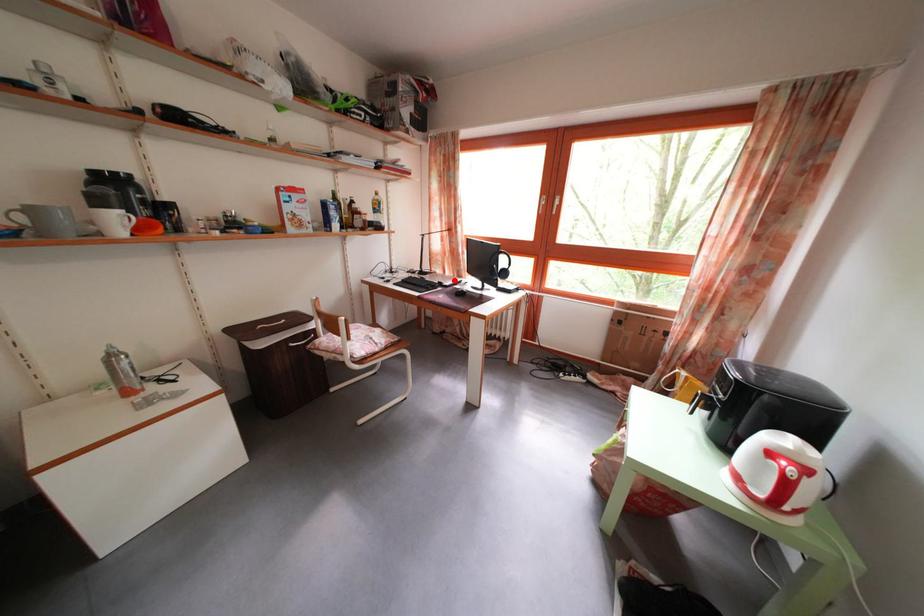
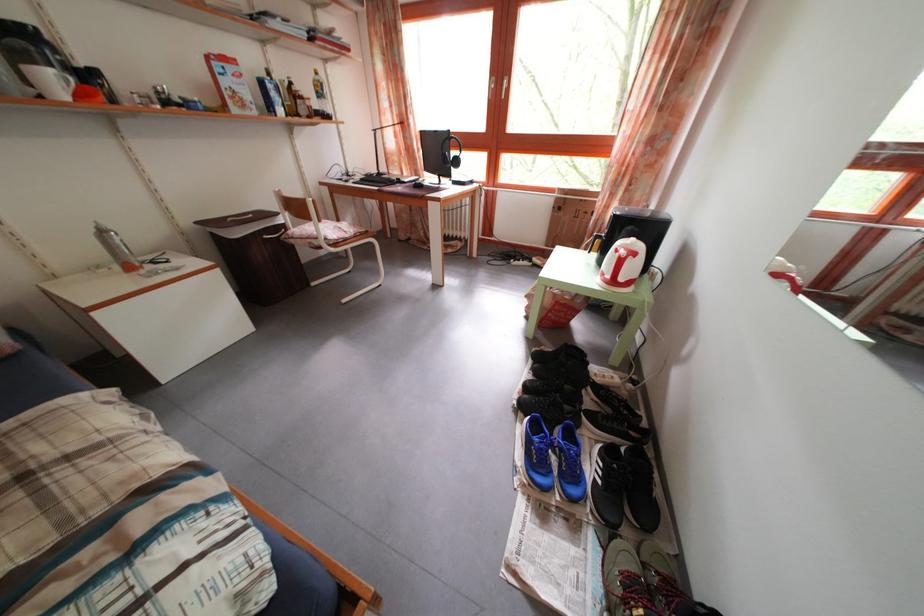
Find the pixel in the second image that matches the highlighted location in the first image.

(412, 182)